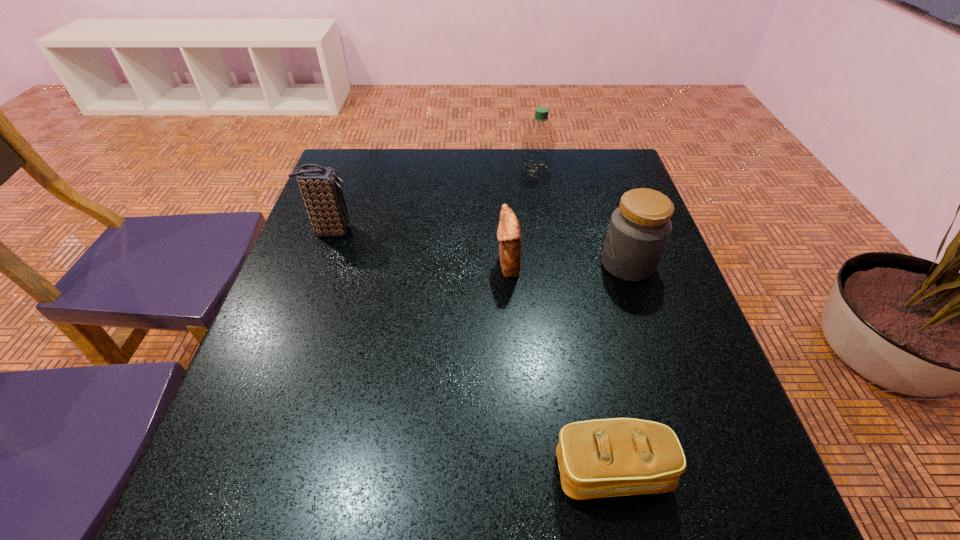
Find the location of `clutch bag that is at the right edge`. clutch bag that is at the right edge is located at coordinates (600, 458).

Find the location of a particular element. object that is at the near right corner is located at coordinates (600, 458).

Find the location of `vacant space at the far edge`. vacant space at the far edge is located at coordinates (461, 168).

This screenshot has width=960, height=540. I want to click on free point at the near edge, so click(494, 529).

Identify the location of vacant space at the left edge of the desktop. Image resolution: width=960 pixels, height=540 pixels. (305, 298).

Identify the location of vacant region at the right edge of the desktop. (598, 264).

In order to click on vacant region at the far left corner of the desktop in this screenshot , I will do `click(346, 156)`.

The height and width of the screenshot is (540, 960). What are the coordinates of `vacant space at the far right corner of the desktop` in the screenshot? It's located at (587, 164).

In the image, there is a desktop. At what (x,y) coordinates should I click in order to perform the action: click on vacant space at the near right corner. Please return your answer as a coordinate pair (x, y). The image size is (960, 540). Looking at the image, I should click on click(737, 503).

Where is `vacant area between the leftmost object and the farthest object`? The width and height of the screenshot is (960, 540). vacant area between the leftmost object and the farthest object is located at coordinates (433, 201).